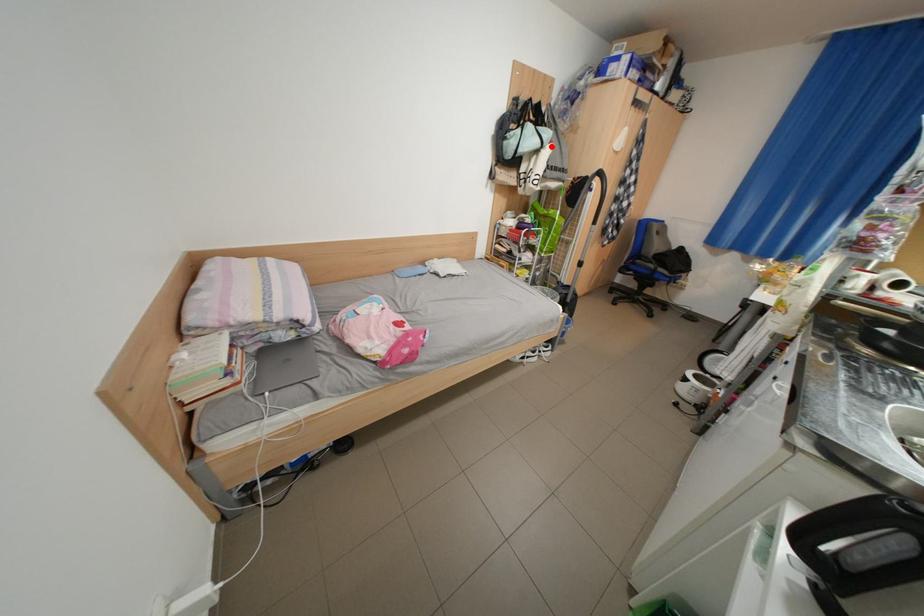
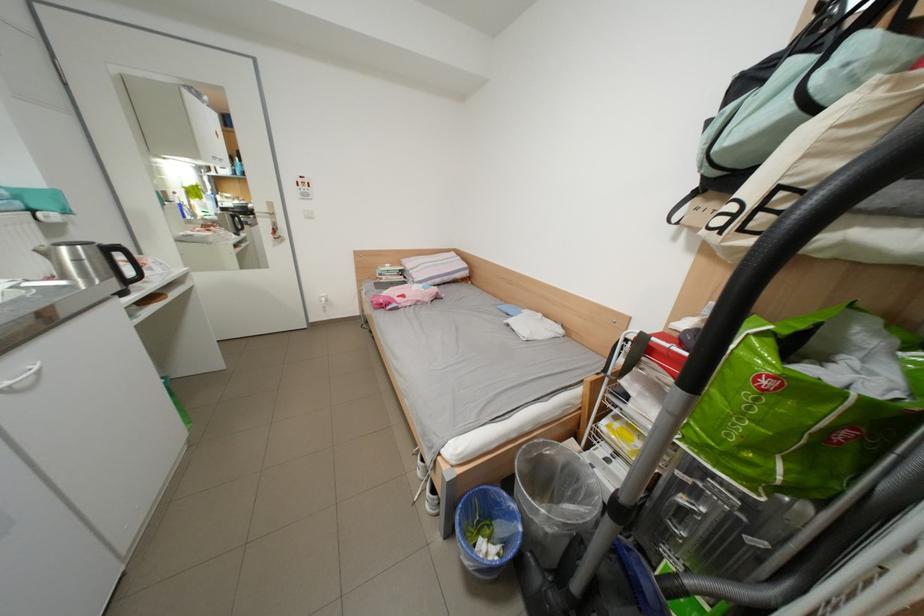
Question: I am providing you with two images of the same scene from different viewpoints. Image1 has a red point marked. In image2, the corresponding 3D location appears at what relative position? Reply with the corresponding letter.

Choices:
 (A) Closer
 (B) Farther

Answer: (B)